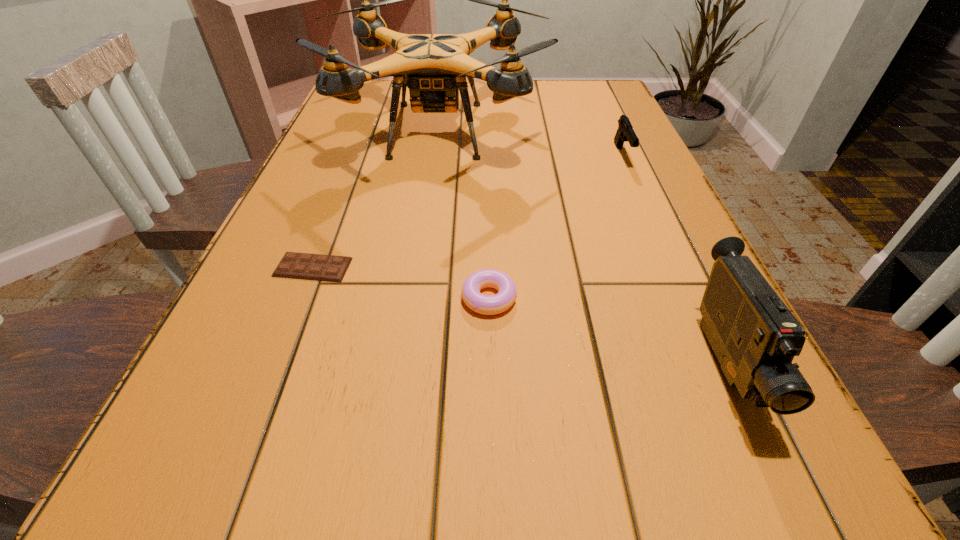
Identify the location of vacant region between the pistol and the drone. (530, 142).

Where is `object that can be found as the second closest to the second tallest object`? This screenshot has width=960, height=540. object that can be found as the second closest to the second tallest object is located at coordinates (434, 67).

Where is `object that stands as the fourth closest to the third shortest object`? object that stands as the fourth closest to the third shortest object is located at coordinates (330, 268).

I want to click on free space that satisfies the following two spatial constraints: 1. on the camera mount of the drone; 2. on the back side of the second shortest object, so click(x=413, y=298).

What are the coordinates of `free space that satisfies the following two spatial constraints: 1. on the camera mount of the tallest object; 2. on the left side of the second shortest object` in the screenshot? It's located at (413, 298).

The height and width of the screenshot is (540, 960). I want to click on free spot that satisfies the following two spatial constraints: 1. on the camera mount of the tallest object; 2. on the front side of the chocolate bar, so click(417, 267).